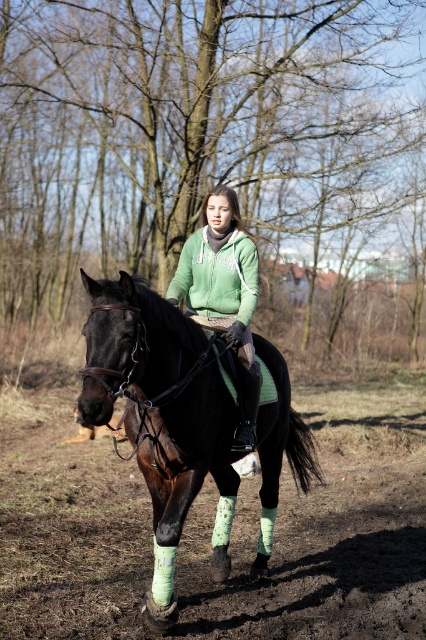
You are a photographer trying to capture the horse and rider in the image. The horse is at point (158, 412). The rider is wearing a light green hoodie. Where should you position your camera to ensure both the horse and the rider are in focus?

The horse is at point (158, 412), so position the camera to focus on that point to capture both the horse and rider clearly.

You are a photographer trying to capture a photo of the shiny black horse at center. You need to position your camera so that the dull brown dirt at lower center is not visible in the shot. Is this possible given their relative heights?

The dull brown dirt at lower center is shorter than the shiny black horse at center, so if you position the camera high enough, you can angle it to block the view of the dull brown dirt at lower center behind the horse.